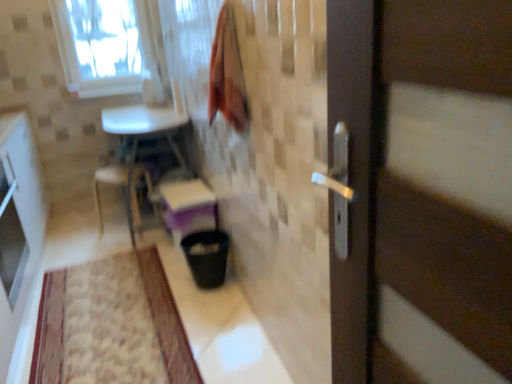
In the scene shown: Measure the distance between point [69,14] and camera.

Point [69,14] and camera are 3.21 meters apart.

This screenshot has width=512, height=384. Find the location of `black plastic trash can at lower center`. black plastic trash can at lower center is located at coordinates (207, 257).

The height and width of the screenshot is (384, 512). In order to click on beige textured mat at lower left in this screenshot , I will do `click(112, 324)`.

Between transparent glass window at upper left and white glossy cabinet at left, which one has more height?

With more height is white glossy cabinet at left.

Is the position of transparent glass window at upper left more distant than that of white glossy cabinet at left?

Yes.

Which object is thinner, transparent glass window at upper left or white glossy cabinet at left?

With smaller width is transparent glass window at upper left.

Is transparent glass window at upper left facing away from white glossy cabinet at left?

No, white glossy cabinet at left is not at the back of transparent glass window at upper left.

From a real-world perspective, which object stands above the other?

white glossy cabinet at left is physically above.

Could white glossy cabinet at left be considered to be inside black plastic trash can at lower center?

No.

This screenshot has height=384, width=512. Identify the location of cabinetry above the black plastic trash can at lower center (from the image's perspective). (19, 202).

Is white plastic chair at lower left looking in the opposite direction of transparent glass window at upper left?

No, white plastic chair at lower left's orientation is not away from transparent glass window at upper left.

Is point (126, 208) positioned behind point (115, 15)?

No, it is in front of (115, 15).

How different are the orientations of white plastic chair at lower left and transparent glass window at upper left in degrees?

They differ by 106 degrees in their facing directions.

From a real-world perspective, is white plastic chair at lower left below transparent glass window at upper left?

Indeed, from a real-world perspective, white plastic chair at lower left is positioned beneath transparent glass window at upper left.

Is transparent glass window at upper left outside of velvet pink blanket at upper center?

Yes, transparent glass window at upper left is located beyond the bounds of velvet pink blanket at upper center.

From the picture: Which is nearer, (113, 87) or (241, 81)?

Clearly, point (113, 87) is more distant from the camera than point (241, 81).

You are a GUI agent. You are given a task and a screenshot of the screen. Output one action in this format:
    pyautogui.click(x=<x>, y=<y>)
    Task: Click on the blanket below the transparent glass window at upper left (from the image's perspective)
    
    Given the screenshot: What is the action you would take?
    pyautogui.click(x=227, y=74)

Looking at the image, does matte white step stool at center seem bigger or smaller compared to black plastic trash can at lower center?

matte white step stool at center is bigger than black plastic trash can at lower center.

Considering the sizes of matte white step stool at center and black plastic trash can at lower center in the image, is matte white step stool at center taller or shorter than black plastic trash can at lower center?

In the image, matte white step stool at center appears to be taller than black plastic trash can at lower center.

Measure the distance from matte white step stool at center to black plastic trash can at lower center.

The distance of matte white step stool at center from black plastic trash can at lower center is 9.09 inches.

From the image's perspective, is matte white step stool at center under black plastic trash can at lower center?

No, from the image's perspective, matte white step stool at center is not below black plastic trash can at lower center.

Considering the sizes of matte white step stool at center and white glossy cabinet at left in the image, is matte white step stool at center taller or shorter than white glossy cabinet at left?

Considering their sizes, matte white step stool at center has less height than white glossy cabinet at left.

Considering the relative sizes of matte white step stool at center and white glossy cabinet at left in the image provided, is matte white step stool at center wider than white glossy cabinet at left?

Yes.

Consider the image. Is beige textured mat at lower left in front of white plastic chair at lower left?

Yes.

From a real-world perspective, who is located lower, beige textured mat at lower left or white plastic chair at lower left?

beige textured mat at lower left, from a real-world perspective.

Considering the sizes of objects beige textured mat at lower left and white plastic chair at lower left in the image provided, who is shorter, beige textured mat at lower left or white plastic chair at lower left?

beige textured mat at lower left is shorter.

The width and height of the screenshot is (512, 384). Find the location of `cabinetry that appears in front of the transparent glass window at upper left`. cabinetry that appears in front of the transparent glass window at upper left is located at coordinates (19, 202).

Where is `trash bin/can behind the white glossy cabinet at left`? The height and width of the screenshot is (384, 512). trash bin/can behind the white glossy cabinet at left is located at coordinates (207, 257).

Considering their positions, is white plastic chair at lower left positioned further to white glossy cabinet at left than beige textured mat at lower left?

white plastic chair at lower left is further to white glossy cabinet at left.

Estimate the real-world distances between objects in this image. Which object is closer to velvet pink blanket at upper center, beige textured mat at lower left or matte white step stool at center?

matte white step stool at center.

Based on their spatial positions, is white glossy cabinet at left or beige textured mat at lower left closer to white plastic chair at lower left?

white glossy cabinet at left is positioned closer to the anchor white plastic chair at lower left.

From the image, which object appears to be farther from transparent glass window at upper left, black plastic trash can at lower center or white plastic chair at lower left?

Based on the image, black plastic trash can at lower center appears to be further to transparent glass window at upper left.

Which object lies nearer to the anchor point matte white step stool at center, black plastic trash can at lower center or white glossy cabinet at left?

black plastic trash can at lower center is positioned closer to the anchor matte white step stool at center.

Based on their spatial positions, is matte white step stool at center or white plastic chair at lower left further from transparent glass window at upper left?

Among the two, matte white step stool at center is located further to transparent glass window at upper left.

From the image, which object appears to be farther from velvet pink blanket at upper center, black plastic trash can at lower center or white glossy cabinet at left?

white glossy cabinet at left.

Based on their spatial positions, is black plastic trash can at lower center or white plastic chair at lower left closer to beige textured mat at lower left?

Among the two, black plastic trash can at lower center is located nearer to beige textured mat at lower left.

Where is `step stool between velvet pink blanket at upper center and white plastic chair at lower left along the z-axis`? step stool between velvet pink blanket at upper center and white plastic chair at lower left along the z-axis is located at coordinates (187, 205).

The image size is (512, 384). What are the coordinates of `step stool between white glossy cabinet at left and velvet pink blanket at upper center from left to right` in the screenshot? It's located at (187, 205).

Where is `cabinetry between transparent glass window at upper left and beige textured mat at lower left in the up-down direction`? The image size is (512, 384). cabinetry between transparent glass window at upper left and beige textured mat at lower left in the up-down direction is located at coordinates (19, 202).

The image size is (512, 384). What are the coordinates of `trash bin/can between white glossy cabinet at left and velvet pink blanket at upper center in the horizontal direction` in the screenshot? It's located at (207, 257).